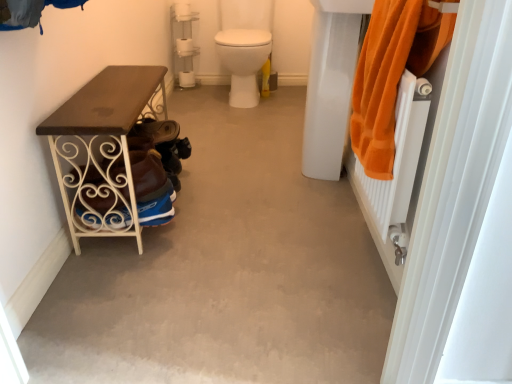
At what (x,y) coordinates should I click in order to perform the action: click on blank space to the left of white glossy sink at upper right. Please return your answer as a coordinate pair (x, y). The width and height of the screenshot is (512, 384). Looking at the image, I should click on (286, 163).